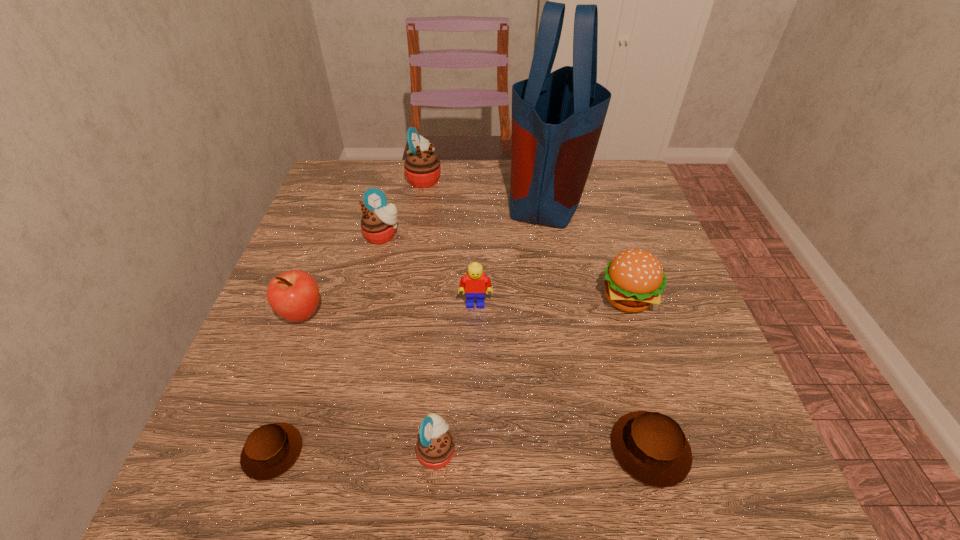
Where is `the nearest pink muffin`? This screenshot has width=960, height=540. the nearest pink muffin is located at coordinates (435, 446).

Image resolution: width=960 pixels, height=540 pixels. What are the coordinates of `the second shortest muffin` in the screenshot? It's located at (651, 447).

This screenshot has width=960, height=540. What are the coordinates of `the rightmost muffin` in the screenshot? It's located at (651, 447).

In order to click on the shortest object in this screenshot , I will do `click(270, 450)`.

At what (x,y) coordinates should I click in order to perform the action: click on the left brown muffin. Please return your answer as a coordinate pair (x, y). Looking at the image, I should click on (270, 450).

The height and width of the screenshot is (540, 960). Find the location of `free space located on the front of the red handbag`. free space located on the front of the red handbag is located at coordinates (585, 378).

Identify the location of free space located 0.360m on the front-facing side of the biggest pink muffin. (572, 178).

Locate an element on the screen. vacant space located on the front-facing side of the second tallest muffin is located at coordinates (359, 333).

Image resolution: width=960 pixels, height=540 pixels. I want to click on vacant space situated on the back of the hamburger, so pyautogui.click(x=599, y=208).

Where is `vacant region located on the front of the pink apple`? This screenshot has width=960, height=540. vacant region located on the front of the pink apple is located at coordinates (247, 464).